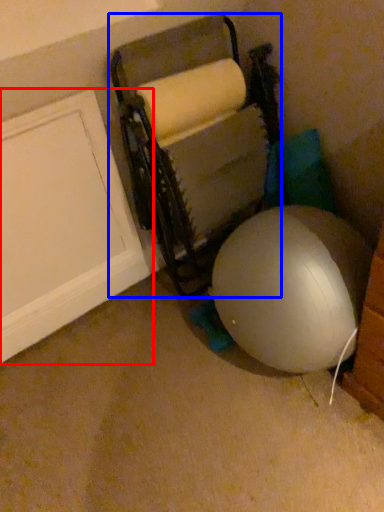
Question: Which object appears closest to the camera in this image, door (highlighted by a red box) or bean bag chair (highlighted by a blue box)?

Choices:
 (A) door
 (B) bean bag chair

Answer: (B)